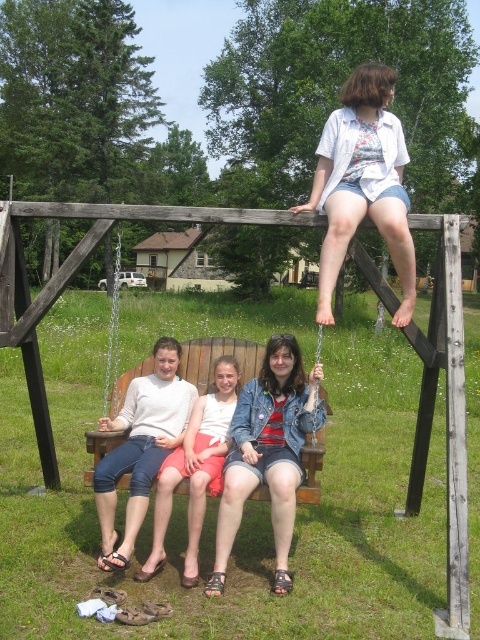
You are a photographer trying to capture a photo of the matte white sweater at center and denim shorts at center. Since the swing set is elevated, you want to ensure your camera is positioned at a height that can clearly see both items. Considering their sizes, which item should you focus on adjusting the camera angle for first?

The matte white sweater at center is larger than the denim shorts at center, so you should focus on adjusting the camera angle to accommodate the larger size of the matte white sweater at center first.